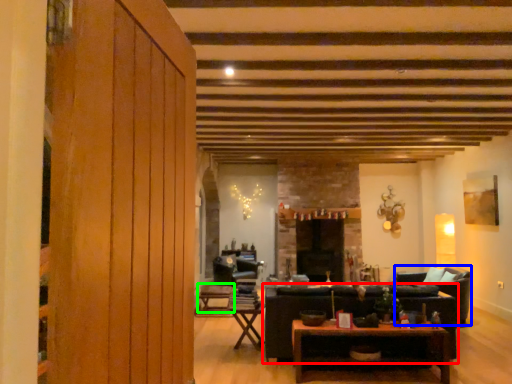
Question: Which object is positioned closest to studio couch (highlighted by a red box)? Select from armchair (highlighted by a blue box) and table (highlighted by a green box).

Choices:
 (A) armchair
 (B) table

Answer: (A)